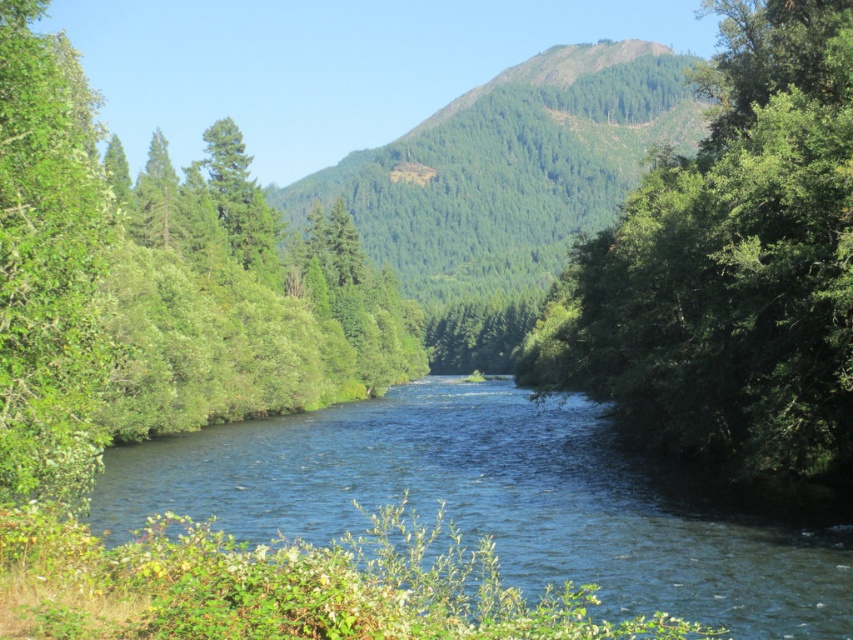
Question: Can you confirm if green leafy tree at left is bigger than green textured trees at center?

Choices:
 (A) yes
 (B) no

Answer: (B)

Question: Which of the following is the closest to the observer?

Choices:
 (A) (383, 456)
 (B) (36, 392)
 (C) (642, 432)
 (D) (454, 365)

Answer: (B)

Question: Does blue water at center have a lesser width compared to green leafy tree at left?

Choices:
 (A) no
 (B) yes

Answer: (A)

Question: Which point appears closest to the camera in this image?

Choices:
 (A) (24, 193)
 (B) (520, 250)

Answer: (A)

Question: Which point is closer to the camera taking this photo?

Choices:
 (A) 549,250
 (B) 64,92
 (C) 537,304

Answer: (B)

Question: Is green leafy tree at center below green forested mountain at center?

Choices:
 (A) no
 (B) yes

Answer: (B)